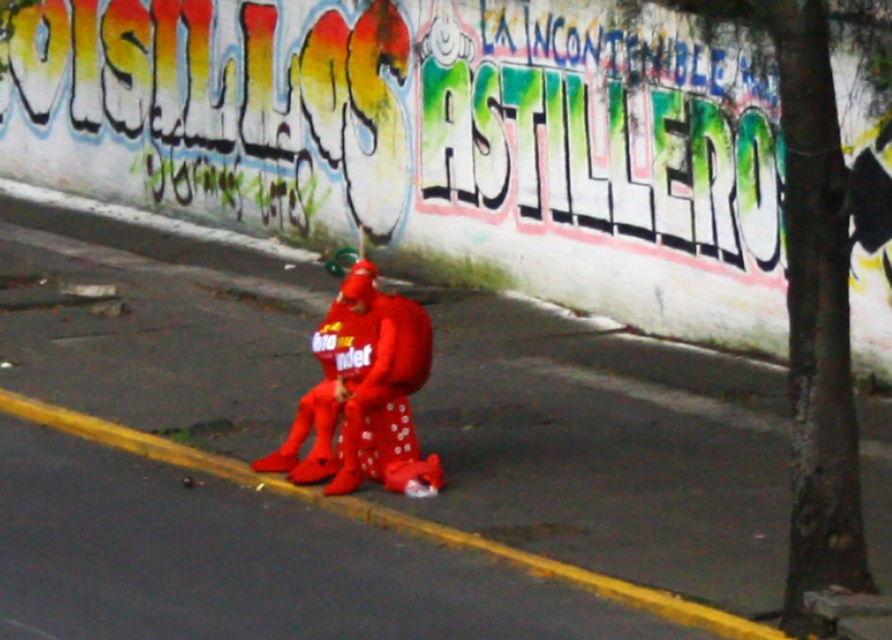
Question: Which of the following is the closest to the observer?

Choices:
 (A) matte red costume at center
 (B) matte red pavement at center

Answer: (B)

Question: Is matte red pavement at center below matte red costume at center?

Choices:
 (A) yes
 (B) no

Answer: (B)

Question: From the image, what is the correct spatial relationship of matte red pavement at center in relation to matte red costume at center?

Choices:
 (A) right
 (B) left

Answer: (B)

Question: Does matte red pavement at center have a smaller size compared to matte red costume at center?

Choices:
 (A) yes
 (B) no

Answer: (B)

Question: Which point is closer to the camera?

Choices:
 (A) (334, 467)
 (B) (267, 292)

Answer: (A)

Question: Among these points, which one is farthest from the camera?

Choices:
 (A) (764, 396)
 (B) (321, 342)

Answer: (A)